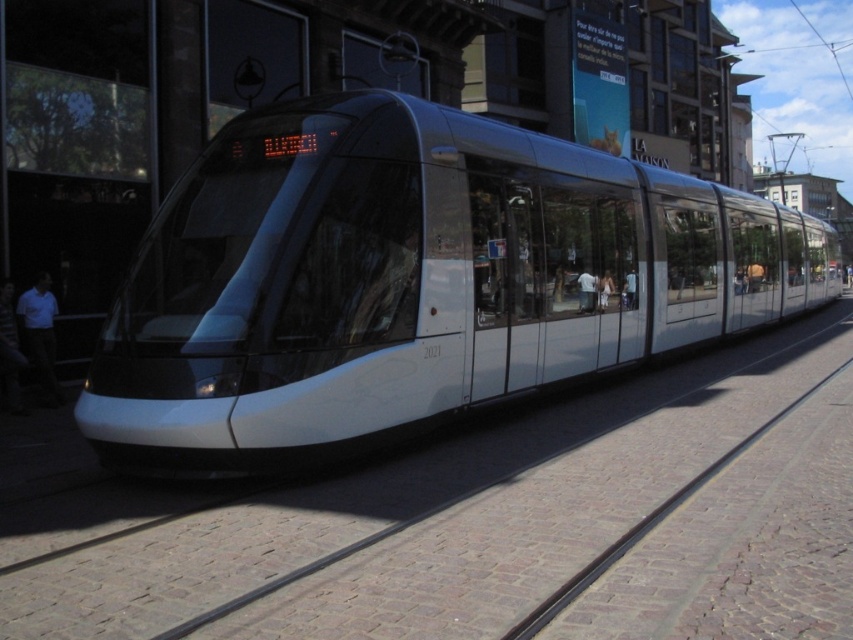
You are standing on the cobblestone street next to the tram tracks. The white glossy train at center is approaching you. If you need to step back to a safe distance of 20 feet before it arrives, do you need to move further back?

The white glossy train at center is currently 19.76 feet away from you. Since 19.76 feet is less than 20 feet, you need to step back further to reach the safe distance of 20 feet before the train arrives.

You are a city planner reviewing the tram route. The tram system requires a maintenance depot at the midpoint between the two tracks. Given the white glossy train at center is positioned at coordinates 0.439, 0.484, can you determine if the depot should be placed closer to the tram or further away based on its position?

The white glossy train at center is located at point (412, 280). Since the maintenance depot should be at the midpoint between the two tracks, and the tram is positioned at these coordinates, the depot should be placed at the midpoint, which may be either closer or further depending on the tracks layout not specified here. However, without additional information on the tracks spacing, an exact determination cannot be made.

You are standing on the cobblestone street next to the tram tracks. You see the point marked at coordinates (x=412, y=280). What object is located at that point?

The point at coordinates (x=412, y=280) corresponds to the white glossy train at center.